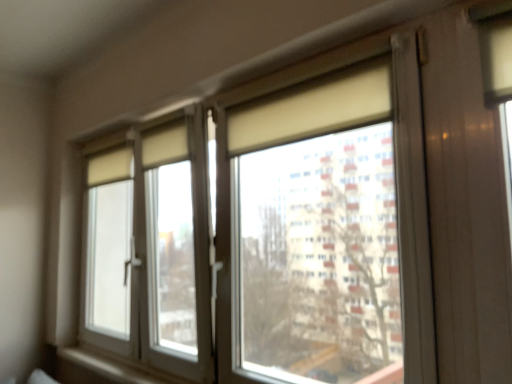
Question: Is white matte window sill at lower left completely or partially inside matte glass window at center?

Choices:
 (A) no
 (B) yes

Answer: (B)

Question: Does matte glass window at center appear on the right side of white matte window sill at lower left?

Choices:
 (A) no
 (B) yes

Answer: (B)

Question: From a real-world perspective, is matte glass window at center physically below white matte window sill at lower left?

Choices:
 (A) yes
 (B) no

Answer: (B)

Question: Is matte glass window at center taller than white matte window sill at lower left?

Choices:
 (A) no
 (B) yes

Answer: (B)

Question: From a real-world perspective, is matte glass window at center positioned over white matte window sill at lower left based on gravity?

Choices:
 (A) yes
 (B) no

Answer: (A)

Question: Considering the relative sizes of matte glass window at center and white matte window sill at lower left in the image provided, is matte glass window at center bigger than white matte window sill at lower left?

Choices:
 (A) yes
 (B) no

Answer: (A)

Question: Would you say white matte window sill at lower left contains matte glass window at center?

Choices:
 (A) no
 (B) yes

Answer: (A)

Question: From the image's perspective, is white matte window sill at lower left under matte glass window at center?

Choices:
 (A) yes
 (B) no

Answer: (A)

Question: Is white matte window sill at lower left oriented away from matte glass window at center?

Choices:
 (A) no
 (B) yes

Answer: (B)

Question: Is white matte window sill at lower left placed right next to matte glass window at center?

Choices:
 (A) yes
 (B) no

Answer: (B)

Question: Is the depth of white matte window sill at lower left less than that of matte glass window at center?

Choices:
 (A) no
 (B) yes

Answer: (A)

Question: Is white matte window sill at lower left outside of matte glass window at center?

Choices:
 (A) no
 (B) yes

Answer: (A)

Question: In the image, is matte glass window at center positioned in front of or behind white matte window sill at lower left?

Choices:
 (A) front
 (B) behind

Answer: (A)